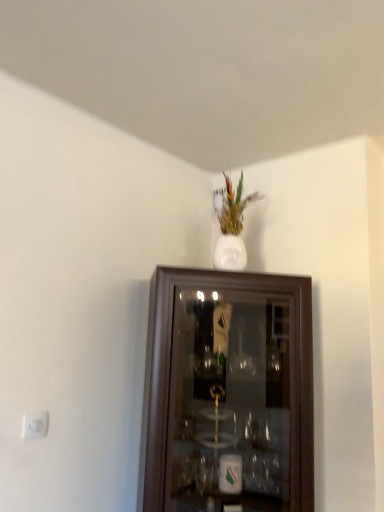
This screenshot has width=384, height=512. Describe the element at coordinates (232, 228) in the screenshot. I see `white glossy vase at upper center` at that location.

You are a GUI agent. You are given a task and a screenshot of the screen. Output one action in this format:
    pyautogui.click(x=<x>, y=<y>)
    Task: Click on the white glossy vase at upper center
    The image size is (384, 512).
    Given the screenshot: What is the action you would take?
    pyautogui.click(x=232, y=228)

Identify the location of white glossy vase at upper center. (232, 228).